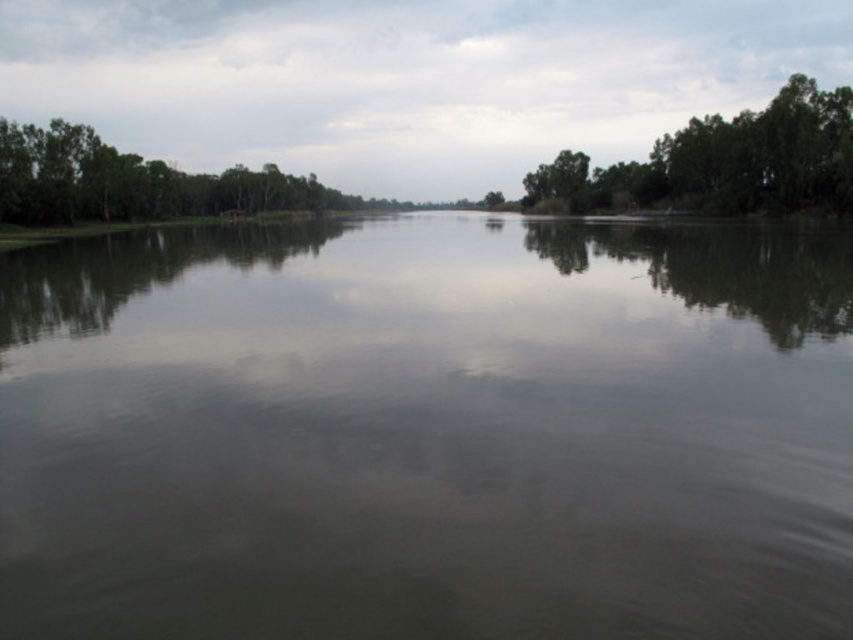
From the picture: You are standing at the center of the river and see a point marked at point (x=724, y=161). Which direction should you look to see this point?

The point (x=724, y=161) is on green leafy trees at right, so you should look to your right to see this point.

You are standing on the riverbank and want to cross the river using a small wooden plank. The plank is exactly as wide as the green leafy trees at left. Will the plank be wide enough to cover the green reflective water at center?

The green reflective water at center is wider than the green leafy trees at left, so the plank, which is as wide as the trees, will not be wide enough to cover the green reflective water at center.